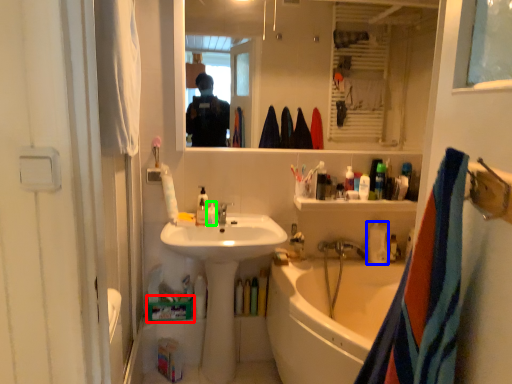
Question: Which object is positioned farthest from box (highlighted by a red box)? Select from bottle (highlighted by a blue box) and toiletry (highlighted by a green box).

Choices:
 (A) bottle
 (B) toiletry

Answer: (A)